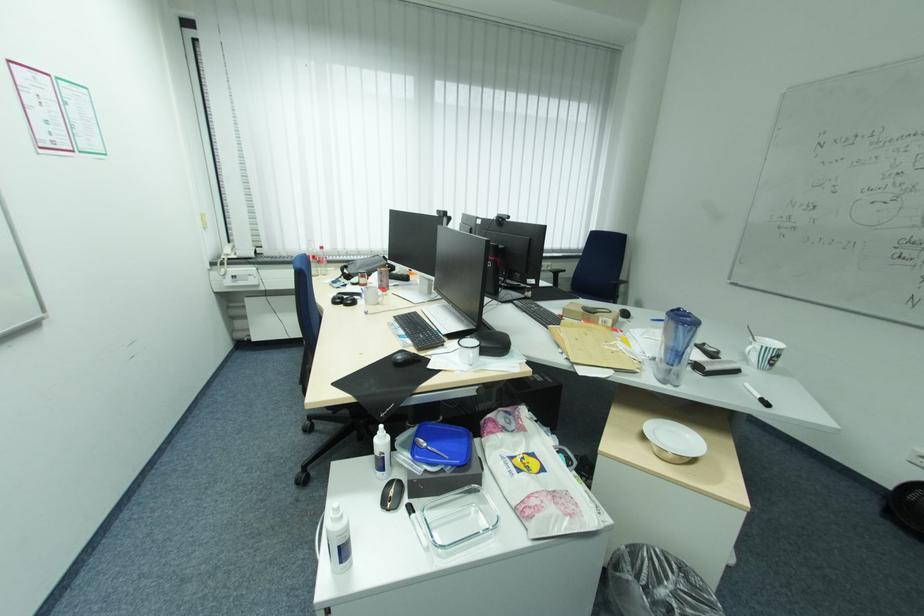
Describe the element at coordinates (557, 267) in the screenshot. This screenshot has width=924, height=616. I see `the blue chair armrest` at that location.